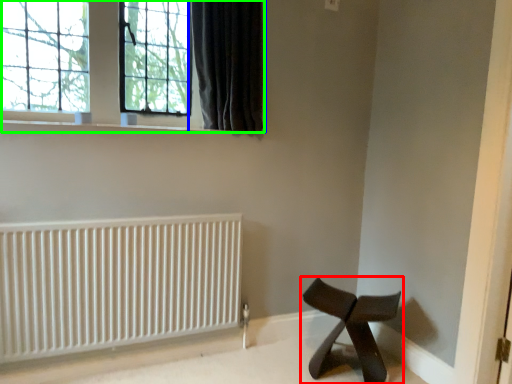
Question: Based on their relative distances, which object is farther from furniture (highlighted by a red box)? Choose from curtain (highlighted by a blue box) and window (highlighted by a green box).

Choices:
 (A) curtain
 (B) window

Answer: (B)